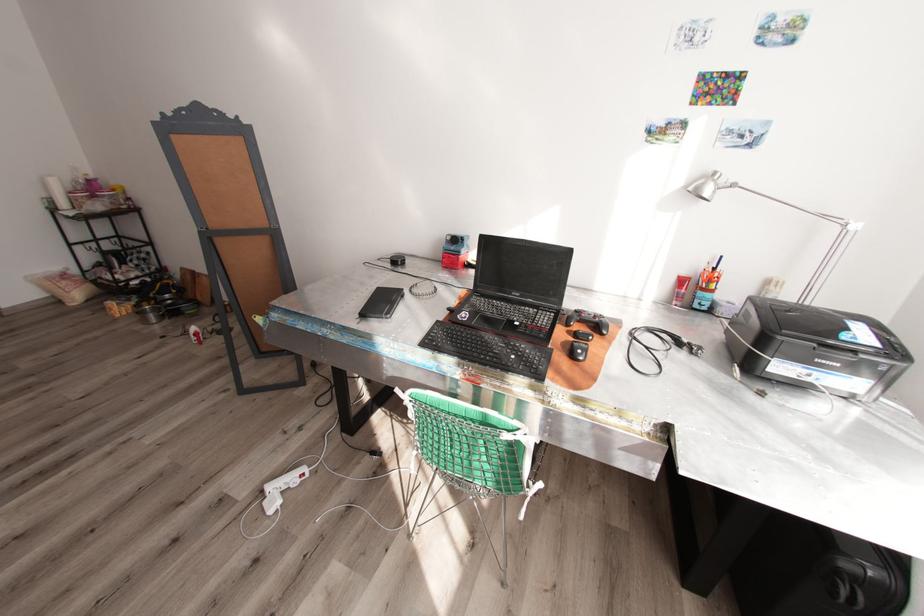
Where would you lift the blue pen holder? Please return your answer as a coordinate pair (x, y).

(706, 286)